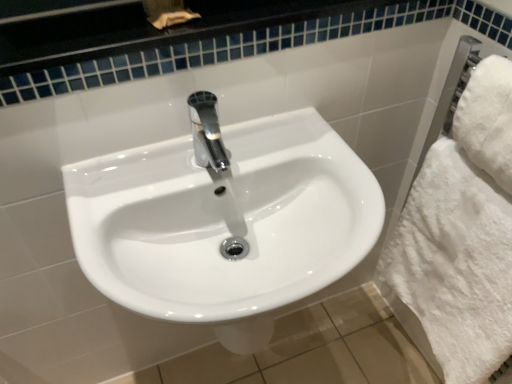
Find the location of a particular element. The height and width of the screenshot is (384, 512). white fluffy towel at right, which appears as the first bath towel when viewed from the top is located at coordinates (488, 119).

What do you see at coordinates (224, 220) in the screenshot? I see `white glossy sink at center` at bounding box center [224, 220].

Identify the location of white fluffy bath towel at right, which is the first bath towel from bottom to top. Image resolution: width=512 pixels, height=384 pixels. (453, 266).

Is white fluffy bath towel at right, which is the first bath towel from bottom to top, far from white glossy sink at center?

white fluffy bath towel at right, which is the first bath towel from bottom to top, is near white glossy sink at center, not far away.

How different are the orientations of white fluffy bath towel at right, which is the first bath towel from bottom to top, and white glossy sink at center in degrees?

white fluffy bath towel at right, which is the first bath towel from bottom to top, and white glossy sink at center are facing 89.4 degrees away from each other.

Considering the positions of points (381, 286) and (197, 317), is point (381, 286) closer to camera compared to point (197, 317)?

No.

This screenshot has width=512, height=384. In order to click on sink above the white fluffy bath towel at right, which is the first bath towel from bottom to top (from a real-world perspective) in this screenshot , I will do `click(224, 220)`.

Consider the image. Which is correct: white glossy sink at center is inside white fluffy towel at right, which appears as the first bath towel when viewed from the top, or outside of it?

white glossy sink at center lies outside white fluffy towel at right, which appears as the first bath towel when viewed from the top.

From a real-world perspective, is white glossy sink at center beneath white fluffy towel at right, which is the second bath towel in bottom-to-top order?

Indeed, from a real-world perspective, white glossy sink at center is positioned beneath white fluffy towel at right, which is the second bath towel in bottom-to-top order.

From the image's perspective, relative to white fluffy towel at right, which is the second bath towel in bottom-to-top order, is white glossy sink at center above or below?

Based on their image positions, white glossy sink at center is located beneath white fluffy towel at right, which is the second bath towel in bottom-to-top order.

From a real-world perspective, between white fluffy towel at right, which appears as the first bath towel when viewed from the top, and white fluffy bath towel at right, which is the first bath towel from bottom to top, who is vertically lower?

white fluffy bath towel at right, which is the first bath towel from bottom to top, from a real-world perspective.

Is white fluffy towel at right, which appears as the first bath towel when viewed from the top, beside white fluffy bath towel at right, which is the first bath towel from bottom to top?

No, white fluffy towel at right, which appears as the first bath towel when viewed from the top, is not touching white fluffy bath towel at right, which is the first bath towel from bottom to top.

Is white fluffy bath towel at right, which is the first bath towel from bottom to top, located within white fluffy towel at right, which appears as the first bath towel when viewed from the top?

Actually, white fluffy bath towel at right, which is the first bath towel from bottom to top, is outside white fluffy towel at right, which appears as the first bath towel when viewed from the top.

Can you confirm if white fluffy towel at right, which is the second bath towel in bottom-to-top order, is wider than white fluffy bath towel at right, which is the first bath towel from bottom to top?

In fact, white fluffy towel at right, which is the second bath towel in bottom-to-top order, might be narrower than white fluffy bath towel at right, which is the first bath towel from bottom to top.

Between white fluffy towel at right, which is the second bath towel in bottom-to-top order, and white glossy sink at center, which one appears on the right side from the viewer's perspective?

From the viewer's perspective, white fluffy towel at right, which is the second bath towel in bottom-to-top order, appears more on the right side.

Locate an element on the screen. The image size is (512, 384). sink in front of the white fluffy towel at right, which is the second bath towel in bottom-to-top order is located at coordinates (224, 220).

Is white fluffy towel at right, which appears as the first bath towel when viewed from the top, in contact with white glossy sink at center?

They are not placed beside each other.

Considering the relative sizes of white fluffy towel at right, which appears as the first bath towel when viewed from the top, and white glossy sink at center in the image provided, is white fluffy towel at right, which appears as the first bath towel when viewed from the top, wider than white glossy sink at center?

No.

Which object is more forward, white glossy sink at center or white fluffy bath towel at right, which is the first bath towel from bottom to top?

white glossy sink at center is more forward.

You are a GUI agent. You are given a task and a screenshot of the screen. Output one action in this format:
    pyautogui.click(x=<x>, y=<y>)
    Task: Click on the sink in front of the white fluffy bath towel at right, which is the first bath towel from bottom to top
    The image size is (512, 384).
    Given the screenshot: What is the action you would take?
    pyautogui.click(x=224, y=220)

Is white glossy sink at center positioned beyond the bounds of white fluffy bath towel at right, the 2th bath towel when ordered from top to bottom?

Yes, white glossy sink at center is located beyond the bounds of white fluffy bath towel at right, the 2th bath towel when ordered from top to bottom.

Can you confirm if white glossy sink at center is taller than white fluffy bath towel at right, the 2th bath towel when ordered from top to bottom?

No.

Where is `bath towel above the white fluffy bath towel at right, the 2th bath towel when ordered from top to bottom (from the image's perspective)`? This screenshot has height=384, width=512. bath towel above the white fluffy bath towel at right, the 2th bath towel when ordered from top to bottom (from the image's perspective) is located at coordinates 488,119.

Is white fluffy bath towel at right, which is the first bath towel from bottom to top, outside of white fluffy towel at right, which is the second bath towel in bottom-to-top order?

white fluffy bath towel at right, which is the first bath towel from bottom to top, is positioned outside white fluffy towel at right, which is the second bath towel in bottom-to-top order.

Consider the image. Which object is wider, white fluffy bath towel at right, the 2th bath towel when ordered from top to bottom, or white fluffy towel at right, which is the second bath towel in bottom-to-top order?

With larger width is white fluffy bath towel at right, the 2th bath towel when ordered from top to bottom.

What are the coordinates of `sink in front of the white fluffy bath towel at right, the 2th bath towel when ordered from top to bottom` in the screenshot? It's located at coord(224,220).

Where is `sink located on the left of white fluffy towel at right, which appears as the first bath towel when viewed from the top`? This screenshot has width=512, height=384. sink located on the left of white fluffy towel at right, which appears as the first bath towel when viewed from the top is located at coordinates (224, 220).

Which object lies further to the anchor point white fluffy bath towel at right, the 2th bath towel when ordered from top to bottom, white fluffy towel at right, which appears as the first bath towel when viewed from the top, or white glossy sink at center?

white glossy sink at center is positioned further to the anchor white fluffy bath towel at right, the 2th bath towel when ordered from top to bottom.

Consider the image. Estimate the real-world distances between objects in this image. Which object is further from white fluffy bath towel at right, the 2th bath towel when ordered from top to bottom, white glossy sink at center or white fluffy towel at right, which is the second bath towel in bottom-to-top order?

white glossy sink at center.

When comparing their distances from white fluffy towel at right, which appears as the first bath towel when viewed from the top, does white glossy sink at center or white fluffy bath towel at right, the 2th bath towel when ordered from top to bottom, seem closer?

Based on the image, white fluffy bath towel at right, the 2th bath towel when ordered from top to bottom, appears to be nearer to white fluffy towel at right, which appears as the first bath towel when viewed from the top.

From the picture: Considering their positions, is white fluffy bath towel at right, the 2th bath towel when ordered from top to bottom, positioned further to white glossy sink at center than white fluffy towel at right, which appears as the first bath towel when viewed from the top?

Based on the image, white fluffy towel at right, which appears as the first bath towel when viewed from the top, appears to be further to white glossy sink at center.

From the image, which object appears to be farther from white fluffy towel at right, which is the second bath towel in bottom-to-top order, white fluffy bath towel at right, the 2th bath towel when ordered from top to bottom, or white glossy sink at center?

white glossy sink at center lies further to white fluffy towel at right, which is the second bath towel in bottom-to-top order, than the other object.

Considering their positions, is white fluffy towel at right, which appears as the first bath towel when viewed from the top, positioned further to white glossy sink at center than white fluffy bath towel at right, which is the first bath towel from bottom to top?

Among the two, white fluffy towel at right, which appears as the first bath towel when viewed from the top, is located further to white glossy sink at center.

This screenshot has height=384, width=512. Find the location of `bath towel between white glossy sink at center and white fluffy towel at right, which appears as the first bath towel when viewed from the top`. bath towel between white glossy sink at center and white fluffy towel at right, which appears as the first bath towel when viewed from the top is located at coordinates (453, 266).